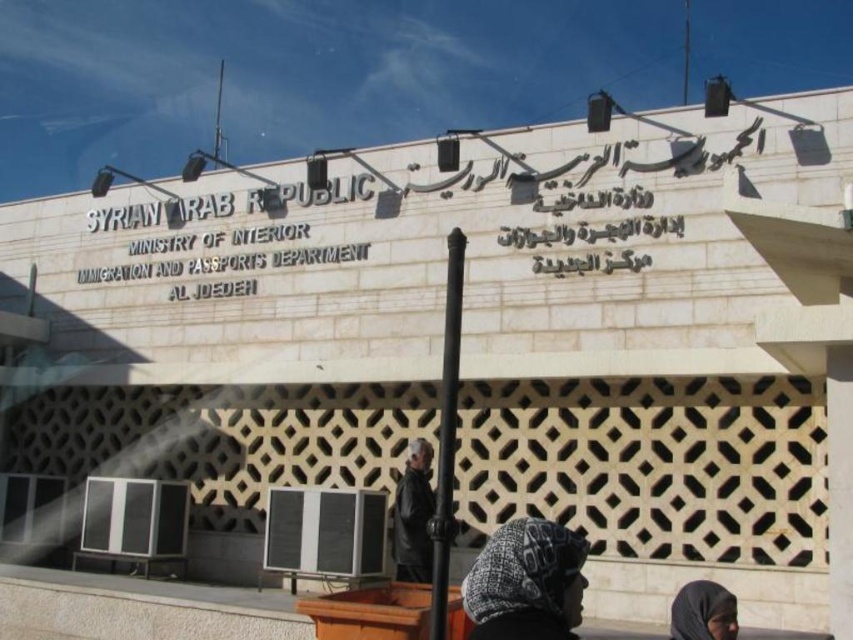
Question: Does knitted woolen hat at lower center appear on the right side of black fabric headscarf at lower right?

Choices:
 (A) no
 (B) yes

Answer: (A)

Question: Is knitted woolen hat at lower center thinner than black fabric headscarf at lower right?

Choices:
 (A) yes
 (B) no

Answer: (A)

Question: Can you confirm if knitted woolen hat at lower center is wider than black fabric headscarf at lower right?

Choices:
 (A) no
 (B) yes

Answer: (A)

Question: Which object appears closest to the camera in this image?

Choices:
 (A) black fabric headscarf at lower right
 (B) knitted woolen hat at lower center

Answer: (B)